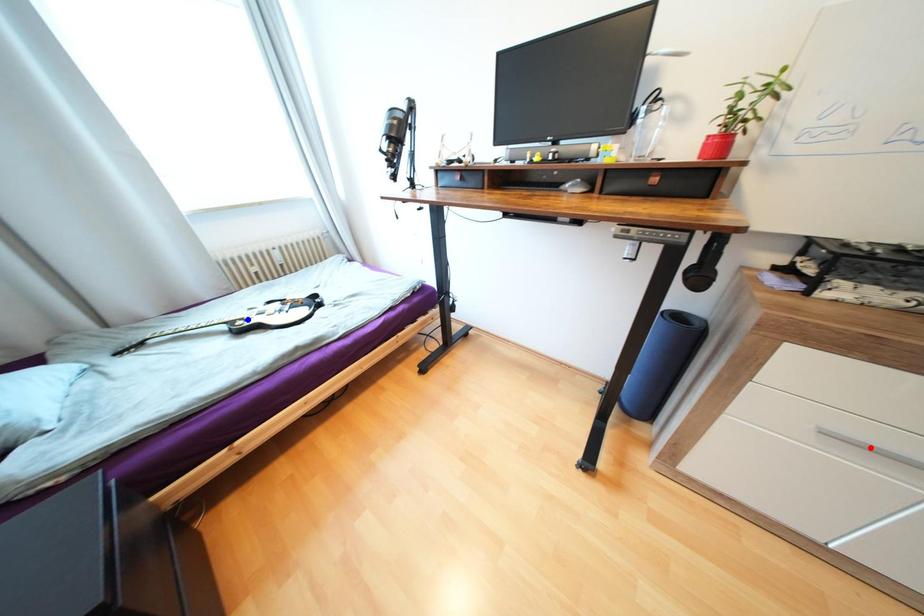
Question: Which of the two points in the image is closer to the camera?

Choices:
 (A) Blue point is closer.
 (B) Red point is closer.

Answer: (B)